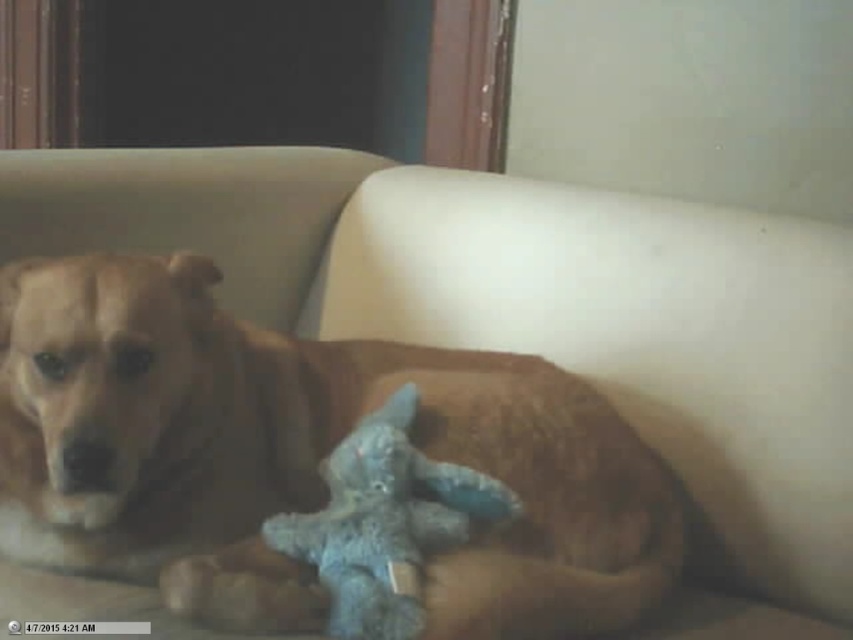
Question: Among these objects, which one is nearest to the camera?

Choices:
 (A) blue plush toy at center
 (B) golden brown fur at center

Answer: (A)

Question: Does golden brown fur at center come behind blue plush toy at center?

Choices:
 (A) no
 (B) yes

Answer: (B)

Question: Can you confirm if golden brown fur at center is positioned to the right of blue plush toy at center?

Choices:
 (A) no
 (B) yes

Answer: (A)

Question: Is golden brown fur at center positioned at the back of blue plush toy at center?

Choices:
 (A) no
 (B) yes

Answer: (B)

Question: Which of the following is the farthest from the observer?

Choices:
 (A) (566, 538)
 (B) (422, 536)

Answer: (A)